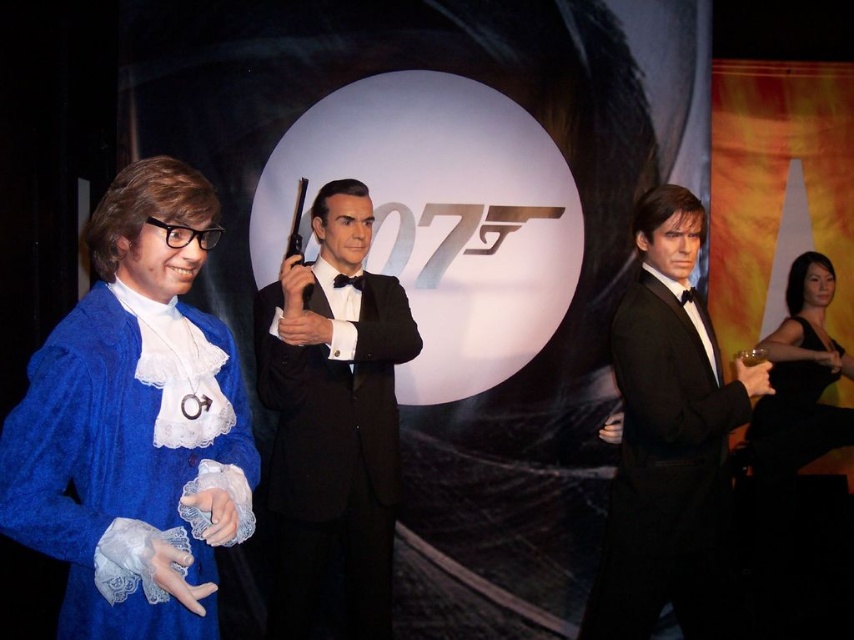
Does shiny black tuxedo at right have a lesser height compared to black satin dress at right?

No, shiny black tuxedo at right is not shorter than black satin dress at right.

Can you confirm if shiny black tuxedo at right is wider than black satin dress at right?

No, shiny black tuxedo at right is not wider than black satin dress at right.

Locate an element on the screen. shiny black tuxedo at right is located at coordinates (670, 442).

Between point (361, 291) and point (689, 310), which one is positioned in front?

Point (689, 310)

This screenshot has width=854, height=640. I want to click on black glossy tuxedo at center, so click(x=332, y=419).

Who is positioned more to the left, shiny black tuxedo at right or black satin bow tie at center?

black satin bow tie at center is more to the left.

Is shiny black tuxedo at right above black satin bow tie at center?

Incorrect, shiny black tuxedo at right is not positioned above black satin bow tie at center.

Does point (723, 628) come closer to viewer compared to point (346, 275)?

Yes, point (723, 628) is in front of point (346, 275).

At what (x,y) coordinates should I click in order to perform the action: click on shiny black tuxedo at right. Please return your answer as a coordinate pair (x, y). The image size is (854, 640). Looking at the image, I should click on (670, 442).